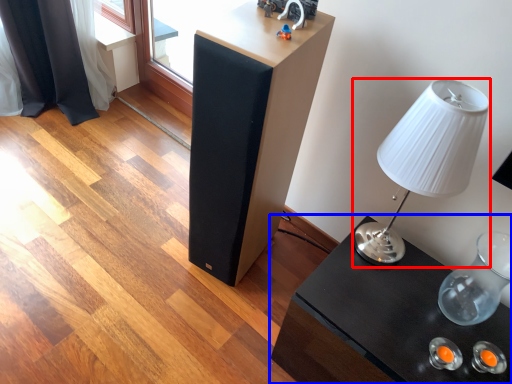
Question: Which point is further to the camera, lamp (highlighted by a red box) or table (highlighted by a blue box)?

Choices:
 (A) lamp
 (B) table

Answer: (B)